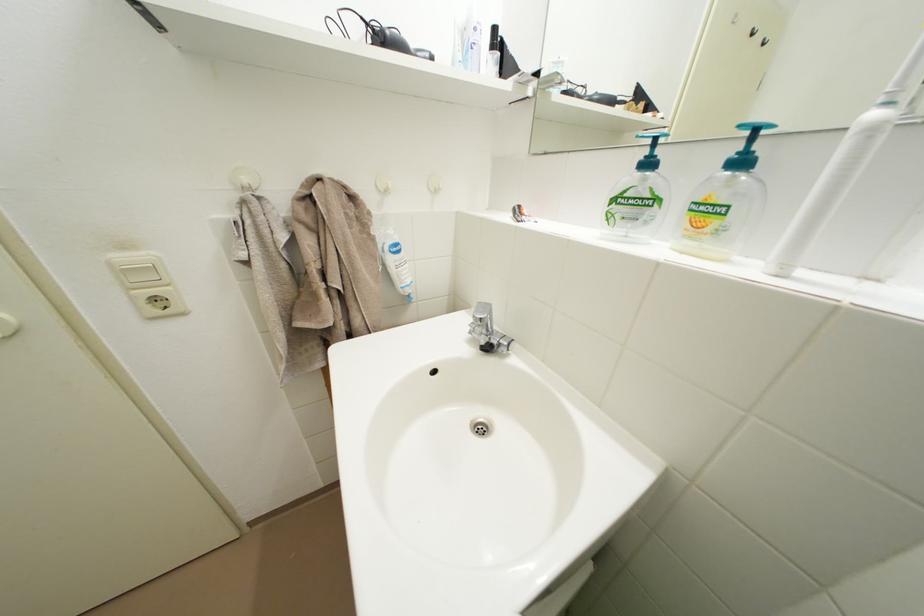
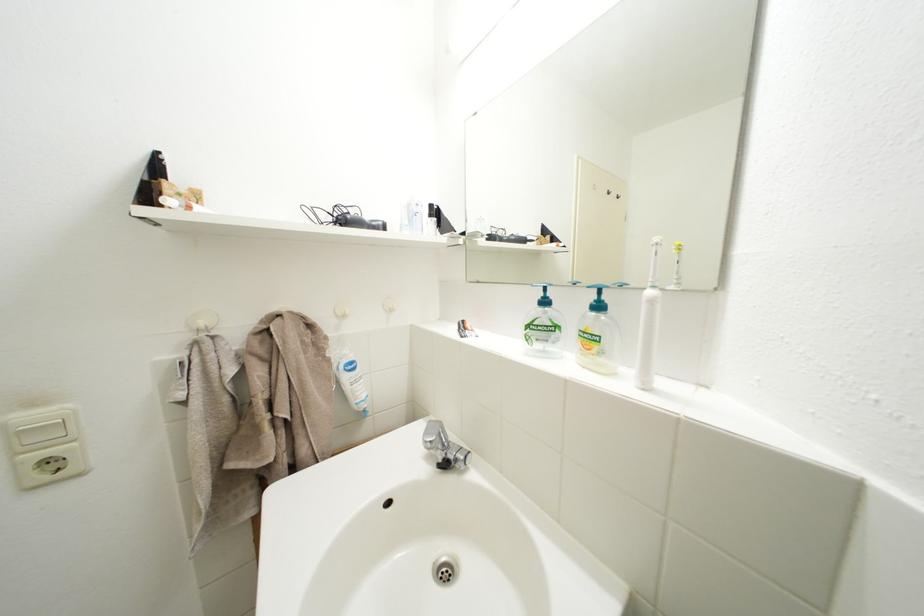
In the second image, find the point that corresponds to point 253,185 in the first image.

(211, 329)